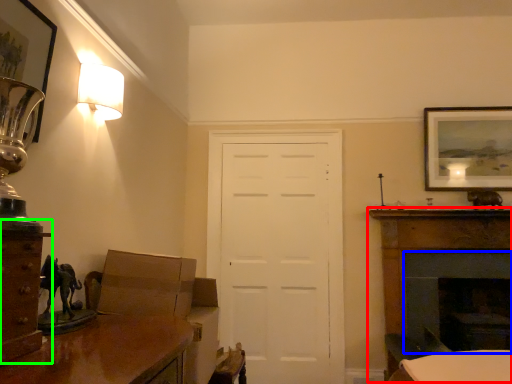
Question: Which is nearer to the fireplace (highlighted by a red box)? fireplace (highlighted by a blue box) or cabinetry (highlighted by a green box).

Choices:
 (A) fireplace
 (B) cabinetry

Answer: (A)